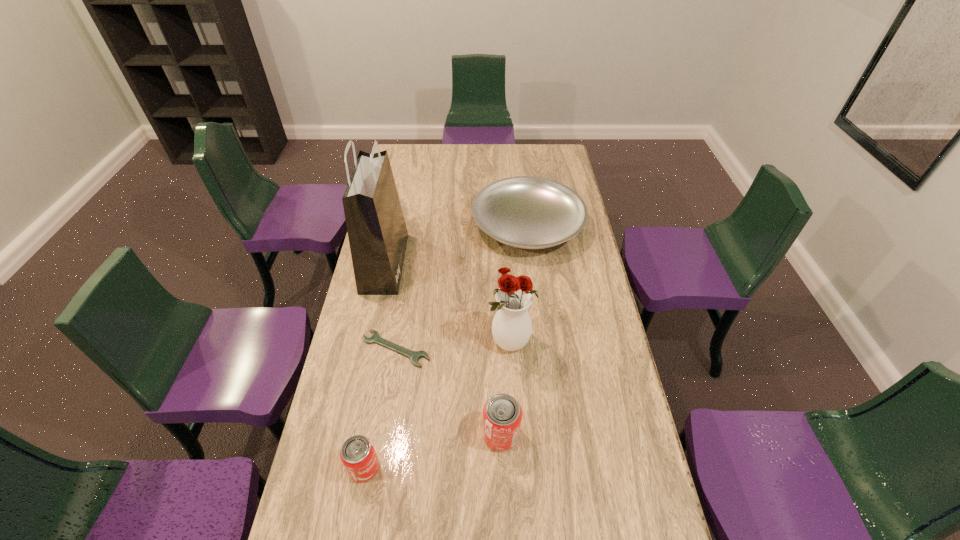
Identify the location of vacant region between the second tallest object and the right can. The width and height of the screenshot is (960, 540). pyautogui.click(x=505, y=389).

Identify the location of empty space between the tallest object and the vase. (447, 303).

Identify which object is the fifth nearest to the second tallest object. Please provide its 2D coordinates. Your answer should be formatted as a tuple, i.e. [(x, y)], where the tuple contains the x and y coordinates of a point satisfying the conditions above.

[(358, 455)]

Identify which object is the third nearest to the tallest object. Please provide its 2D coordinates. Your answer should be formatted as a tuple, i.e. [(x, y)], where the tuple contains the x and y coordinates of a point satisfying the conditions above.

[(511, 327)]

Locate an element on the screen. The width and height of the screenshot is (960, 540). vacant space that satisfies the following two spatial constraints: 1. on the front with handles of the tallest object; 2. on the back side of the left can is located at coordinates (341, 468).

Locate an element on the screen. Image resolution: width=960 pixels, height=540 pixels. free location that satisfies the following two spatial constraints: 1. on the back side of the fifth tallest object; 2. on the left side of the vase is located at coordinates (503, 226).

In order to click on vacant point that satisfies the following two spatial constraints: 1. on the front with handles of the shorter can; 2. on the left side of the shopping bag in this screenshot , I will do `click(341, 468)`.

Where is `free point that satisfies the following two spatial constraints: 1. on the front with handles of the fourth shortest object; 2. on the right side of the tallest object`? free point that satisfies the following two spatial constraints: 1. on the front with handles of the fourth shortest object; 2. on the right side of the tallest object is located at coordinates (348, 435).

Identify the location of vacant point that satisfies the following two spatial constraints: 1. on the front with handles of the left can; 2. on the left side of the shopping bag. (341, 468).

Where is `free space in the image that satisfies the following two spatial constraints: 1. on the front with handles of the shopping bag; 2. on the right side of the taller can`? The image size is (960, 540). free space in the image that satisfies the following two spatial constraints: 1. on the front with handles of the shopping bag; 2. on the right side of the taller can is located at coordinates (348, 435).